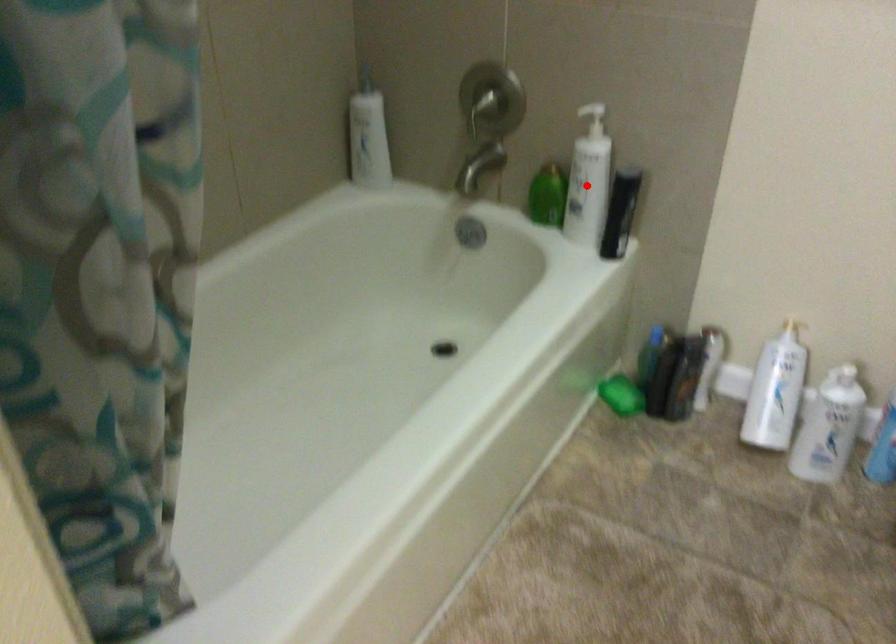
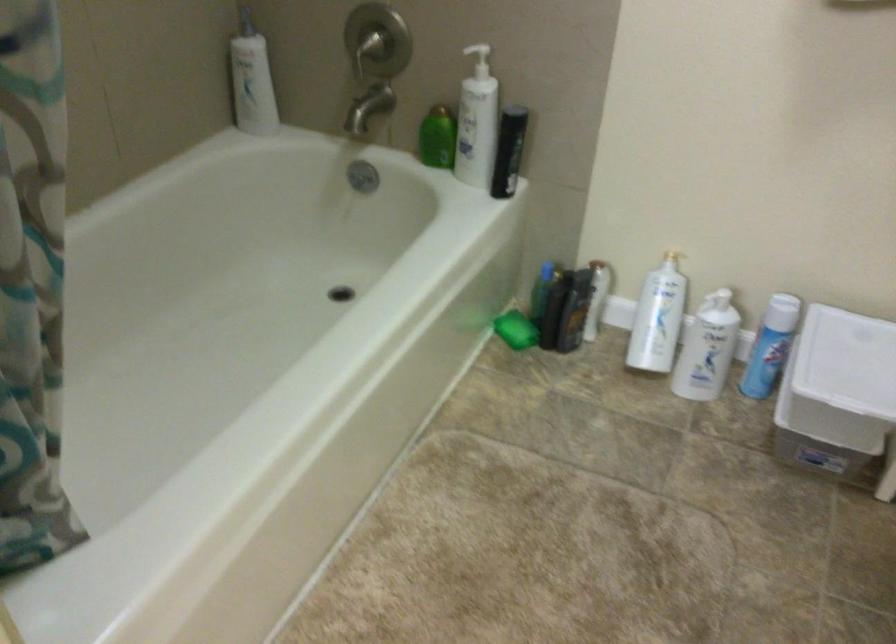
The point at the highlighted location is marked in the first image. Where is the corresponding point in the second image?

(477, 122)